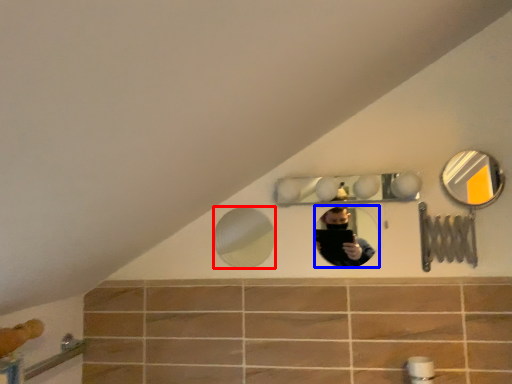
Question: Which of the following is the farthest to the observer, mirror (highlighted by a red box) or mirror (highlighted by a blue box)?

Choices:
 (A) mirror
 (B) mirror

Answer: (A)